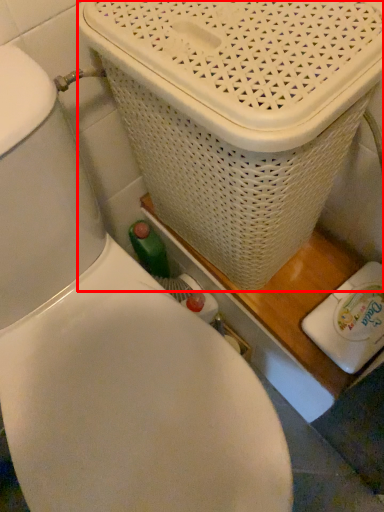
Question: From the image's perspective, where is basket container (annotated by the red box) located relative to appliance?

Choices:
 (A) above
 (B) below

Answer: (A)